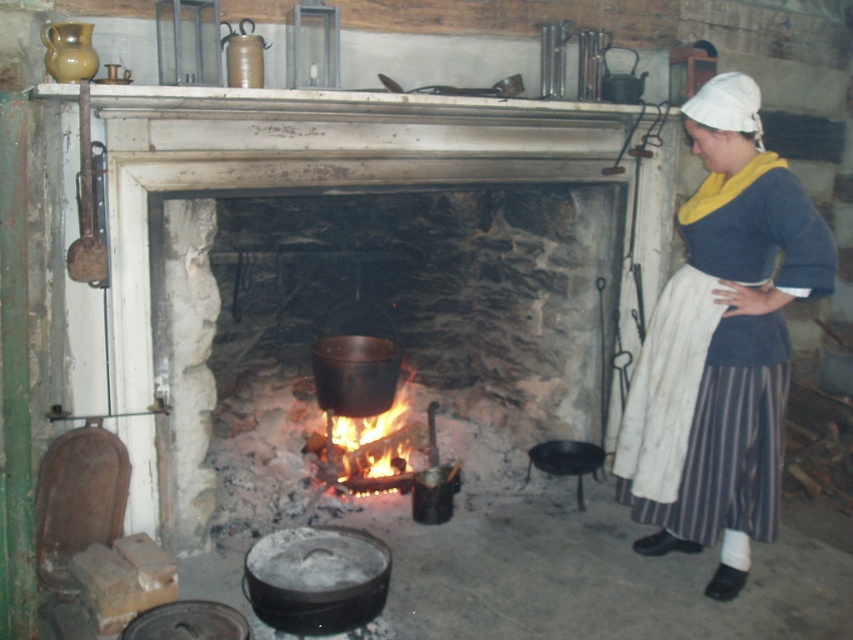
Question: Is matte gray skirt at right to the right of flaming wood at center from the viewer's perspective?

Choices:
 (A) yes
 (B) no

Answer: (A)

Question: Which of the following is the closest to the observer?

Choices:
 (A) black cast iron pot at center
 (B) matte gray skirt at right

Answer: (B)

Question: Is matte gray skirt at right bigger than flaming wood at center?

Choices:
 (A) no
 (B) yes

Answer: (B)

Question: Which point appears closest to the camera in this image?

Choices:
 (A) (747, 556)
 (B) (120, 253)
 (C) (378, 436)

Answer: (B)

Question: From the image, what is the correct spatial relationship of black cast iron pot at center in relation to flaming wood at center?

Choices:
 (A) right
 (B) left

Answer: (A)

Question: Which point is farther to the camera?

Choices:
 (A) (126, 252)
 (B) (741, 173)
 (C) (396, 442)

Answer: (C)